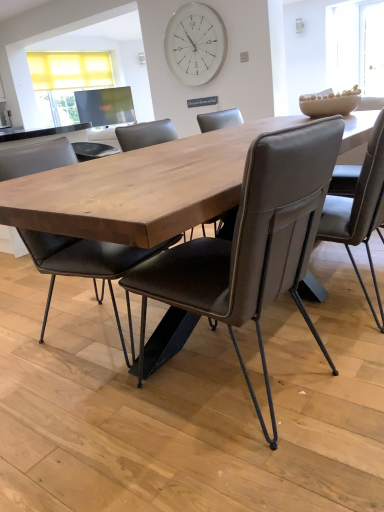
Where is `free point above white glass clock at upper center (from a real-world perspective)`? The height and width of the screenshot is (512, 384). free point above white glass clock at upper center (from a real-world perspective) is located at coordinates (179, 3).